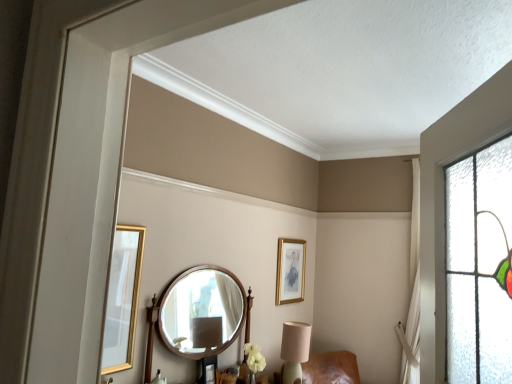
Question: From the image's perspective, is gold-framed picture at upper center above matte beige table lamp at lower center?

Choices:
 (A) yes
 (B) no

Answer: (A)

Question: Is gold-framed picture at upper center shorter than matte beige table lamp at lower center?

Choices:
 (A) no
 (B) yes

Answer: (A)

Question: Is gold-framed picture at upper center positioned in front of matte beige table lamp at lower center?

Choices:
 (A) no
 (B) yes

Answer: (A)

Question: Does gold-framed picture at upper center turn towards matte beige table lamp at lower center?

Choices:
 (A) no
 (B) yes

Answer: (A)

Question: From a real-world perspective, is gold-framed picture at upper center physically below matte beige table lamp at lower center?

Choices:
 (A) yes
 (B) no

Answer: (B)

Question: Visually, is wooden round mirror at center positioned to the left or to the right of gold-framed picture at upper center?

Choices:
 (A) right
 (B) left

Answer: (B)

Question: Considering the positions of point (214, 342) and point (283, 301), is point (214, 342) closer or farther from the camera than point (283, 301)?

Choices:
 (A) farther
 (B) closer

Answer: (B)

Question: In terms of height, does wooden round mirror at center look taller or shorter compared to gold-framed picture at upper center?

Choices:
 (A) short
 (B) tall

Answer: (B)

Question: Relative to gold-framed picture at upper center, is wooden round mirror at center in front or behind?

Choices:
 (A) front
 (B) behind

Answer: (A)

Question: Is matte beige table lamp at lower center inside or outside of wooden round mirror at center?

Choices:
 (A) outside
 (B) inside

Answer: (A)

Question: Is point (289, 375) positioned closer to the camera than point (181, 304)?

Choices:
 (A) farther
 (B) closer

Answer: (B)

Question: From a real-world perspective, is matte beige table lamp at lower center physically located above or below wooden round mirror at center?

Choices:
 (A) below
 (B) above

Answer: (A)

Question: In the image, is matte beige table lamp at lower center on the left side or the right side of wooden round mirror at center?

Choices:
 (A) right
 (B) left

Answer: (A)

Question: Would you say wooden round mirror at center is inside or outside matte beige table lamp at lower center?

Choices:
 (A) inside
 (B) outside

Answer: (B)

Question: Is point (244, 291) closer or farther from the camera than point (283, 327)?

Choices:
 (A) farther
 (B) closer

Answer: (B)